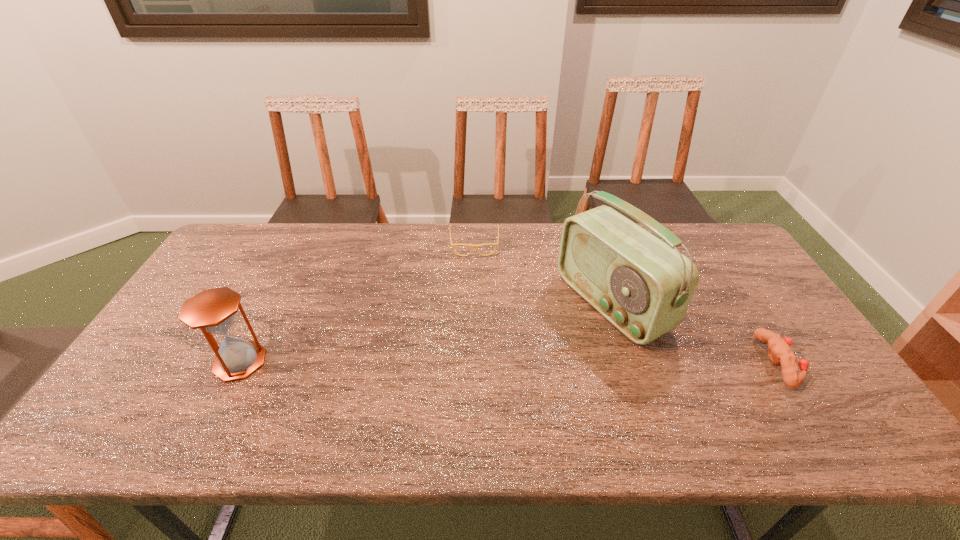
The width and height of the screenshot is (960, 540). Identify the location of hourglass. (213, 310).

The image size is (960, 540). Find the location of `the leftmost object`. the leftmost object is located at coordinates (213, 310).

Where is `the rightmost object`? the rightmost object is located at coordinates (779, 351).

Locate an element on the screen. the second shortest object is located at coordinates (779, 351).

The width and height of the screenshot is (960, 540). Identify the location of the farthest object. (496, 244).

At what (x,y) coordinates should I click in order to perform the action: click on the shortest object. Please return your answer as a coordinate pair (x, y). Looking at the image, I should click on (496, 244).

Locate an element on the screen. This screenshot has height=540, width=960. the second object from right to left is located at coordinates [643, 286].

This screenshot has height=540, width=960. I want to click on the tallest object, so click(643, 286).

I want to click on vacant area located 0.400m on the back of the second tallest object, so click(297, 252).

What are the coordinates of `vacant area situated 0.340m in front of the lenses of the spectacles` in the screenshot? It's located at (476, 334).